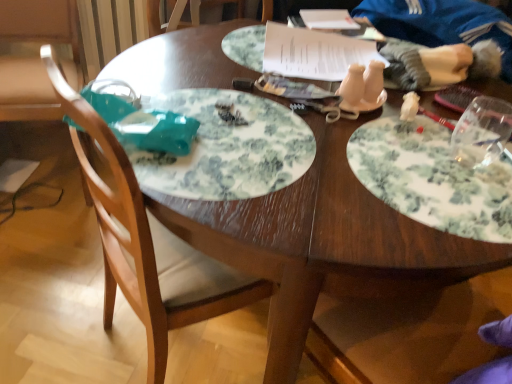
Question: Can you confirm if white floral plate at right, the first plate when ordered from right to left, is positioned to the right of white floral plate at center, which is the second plate from right to left?

Choices:
 (A) yes
 (B) no

Answer: (A)

Question: Is white floral plate at right, the first plate when ordered from right to left, outside white floral plate at center, placed as the first plate when sorted from left to right?

Choices:
 (A) no
 (B) yes

Answer: (B)

Question: From a real-world perspective, is white floral plate at right, the first plate when ordered from right to left, located beneath white floral plate at center, which is the second plate from right to left?

Choices:
 (A) yes
 (B) no

Answer: (B)

Question: From the image's perspective, would you say white floral plate at right, the first plate when ordered from right to left, is shown under white floral plate at center, placed as the first plate when sorted from left to right?

Choices:
 (A) yes
 (B) no

Answer: (A)

Question: Can you confirm if white floral plate at right, the first plate when ordered from right to left, is positioned to the left of white floral plate at center, which is the second plate from right to left?

Choices:
 (A) yes
 (B) no

Answer: (B)

Question: Does white floral plate at right, acting as the 2th plate starting from the left, come behind white floral plate at center, placed as the first plate when sorted from left to right?

Choices:
 (A) yes
 (B) no

Answer: (B)

Question: Is white paper at upper center surrounded by white fabric doll at upper right?

Choices:
 (A) no
 (B) yes

Answer: (A)

Question: Is white fabric doll at upper right outside white paper at upper center?

Choices:
 (A) yes
 (B) no

Answer: (A)

Question: From the image's perspective, is white fabric doll at upper right located above white paper at upper center?

Choices:
 (A) yes
 (B) no

Answer: (B)

Question: Does white fabric doll at upper right have a greater height compared to white paper at upper center?

Choices:
 (A) yes
 (B) no

Answer: (A)

Question: Does white fabric doll at upper right come in front of white paper at upper center?

Choices:
 (A) yes
 (B) no

Answer: (A)

Question: From the image's perspective, does white fabric doll at upper right appear lower than white paper at upper center?

Choices:
 (A) no
 (B) yes

Answer: (B)

Question: Is white paper at upper center at the left side of white fabric doll at upper right?

Choices:
 (A) no
 (B) yes

Answer: (B)